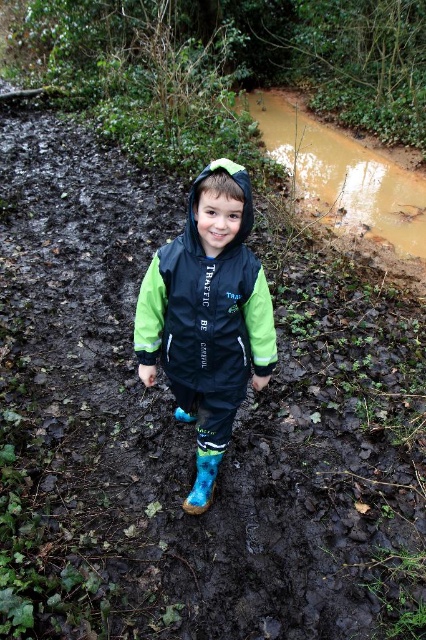
Between black matte jacket at center and blue rubber boot at center, which one has more height?

black matte jacket at center

Is point (138, 314) behind point (201, 509)?

No, it is not.

Where is `black matte jacket at center`? black matte jacket at center is located at coordinates (207, 305).